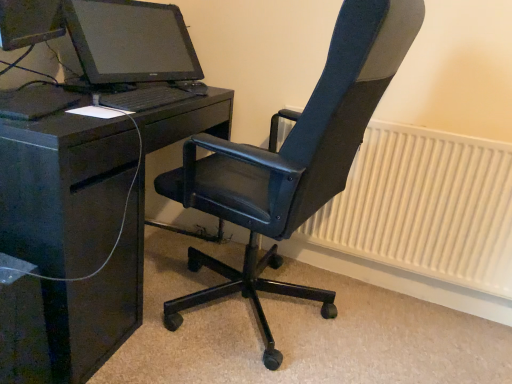
Question: Can we say black leather office chair at center lies outside black glossy desk at left?

Choices:
 (A) no
 (B) yes

Answer: (B)

Question: Considering the relative sizes of black leather office chair at center and black glossy desk at left in the image provided, is black leather office chair at center wider than black glossy desk at left?

Choices:
 (A) no
 (B) yes

Answer: (B)

Question: Can you confirm if black leather office chair at center is shorter than black glossy desk at left?

Choices:
 (A) no
 (B) yes

Answer: (A)

Question: Does black leather office chair at center have a greater height compared to black glossy desk at left?

Choices:
 (A) yes
 (B) no

Answer: (A)

Question: Is black leather office chair at center smaller than black glossy desk at left?

Choices:
 (A) yes
 (B) no

Answer: (B)

Question: Is black leather office chair at center directly adjacent to black glossy desk at left?

Choices:
 (A) yes
 (B) no

Answer: (B)

Question: Does black matte keyboard at center turn towards black leather office chair at center?

Choices:
 (A) yes
 (B) no

Answer: (A)

Question: Is black matte keyboard at center further to camera compared to black leather office chair at center?

Choices:
 (A) yes
 (B) no

Answer: (A)

Question: Is black matte keyboard at center located outside black leather office chair at center?

Choices:
 (A) yes
 (B) no

Answer: (A)

Question: From a real-world perspective, is black matte keyboard at center located higher than black leather office chair at center?

Choices:
 (A) yes
 (B) no

Answer: (A)

Question: From a real-world perspective, does black matte keyboard at center sit lower than black leather office chair at center?

Choices:
 (A) no
 (B) yes

Answer: (A)

Question: Can you confirm if black matte keyboard at center is taller than black leather office chair at center?

Choices:
 (A) no
 (B) yes

Answer: (A)

Question: Is black leather office chair at center thinner than white textured radiator at right?

Choices:
 (A) no
 (B) yes

Answer: (A)